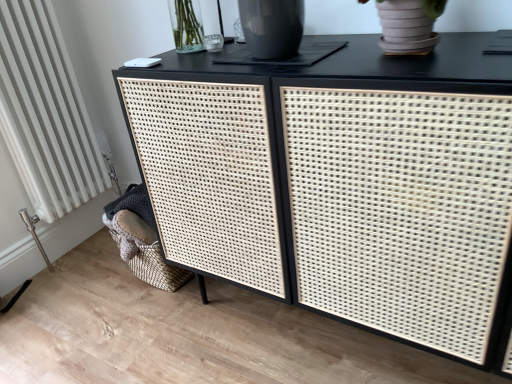
Question: From the image's perspective, is black woven cabinet at center under white textured radiator at lower left?

Choices:
 (A) no
 (B) yes

Answer: (B)

Question: From the image's perspective, is black woven cabinet at center on white textured radiator at lower left?

Choices:
 (A) no
 (B) yes

Answer: (A)

Question: Is black woven cabinet at center positioned with its back to white textured radiator at lower left?

Choices:
 (A) no
 (B) yes

Answer: (A)

Question: Is white textured radiator at lower left a part of black woven cabinet at center?

Choices:
 (A) no
 (B) yes

Answer: (A)

Question: Considering the relative sizes of black woven cabinet at center and white textured radiator at lower left in the image provided, is black woven cabinet at center wider than white textured radiator at lower left?

Choices:
 (A) no
 (B) yes

Answer: (B)

Question: Is black woven cabinet at center positioned far away from white textured radiator at lower left?

Choices:
 (A) yes
 (B) no

Answer: (B)

Question: From a real-world perspective, does white textured radiator at lower left stand above black woven cabinet at center?

Choices:
 (A) yes
 (B) no

Answer: (A)

Question: Is the surface of white textured radiator at lower left in direct contact with black woven cabinet at center?

Choices:
 (A) yes
 (B) no

Answer: (B)

Question: Is white textured radiator at lower left thinner than black woven cabinet at center?

Choices:
 (A) no
 (B) yes

Answer: (B)

Question: Is white textured radiator at lower left completely or partially outside of black woven cabinet at center?

Choices:
 (A) yes
 (B) no

Answer: (A)

Question: Is white textured radiator at lower left facing towards black woven cabinet at center?

Choices:
 (A) no
 (B) yes

Answer: (B)

Question: From a real-world perspective, is white textured radiator at lower left physically below black woven cabinet at center?

Choices:
 (A) no
 (B) yes

Answer: (A)

Question: Considering their positions, is black woven cabinet at center located in front of or behind white textured radiator at lower left?

Choices:
 (A) behind
 (B) front

Answer: (B)